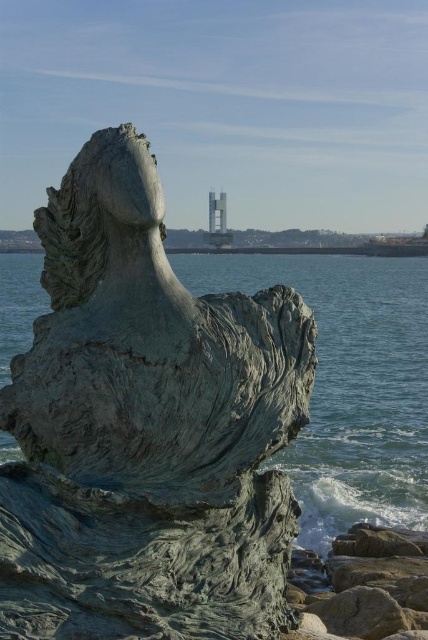
You are standing at the base of the sculpture and want to walk towards the distant modern building. There are two points marked on the path ahead of you. The first point is at coordinate point(284, 588), and the second point is at point(356, 608). Which point should you reach first to stay on the path leading directly to the modern building?

Point(284, 588) is in front of point(356, 608), so you should reach point(284, 588) first to stay on the path leading directly to the modern building.

You are an art student visiting the sculpture. You want to take a photo of the bronze sculpture at center and the rough stone rock at lower right together in the same frame. Which object should you position closer to the camera to ensure both are visible in the photo?

Since the bronze sculpture at center is smaller than the rough stone rock at lower right, you should position the rough stone rock at lower right closer to the camera to ensure both objects are visible in the photo.

You are standing on the rocky shoreline and want to take a photo of the bronze sculpture at center. To avoid including the rough stone rock at lower right in your photo, where should you position yourself relative to the sculpture?

Since the bronze sculpture at center is closer to the viewer than the rough stone rock at lower right, you should position yourself closer to the bronze sculpture at center so that it blocks the view of the rough stone rock at lower right.